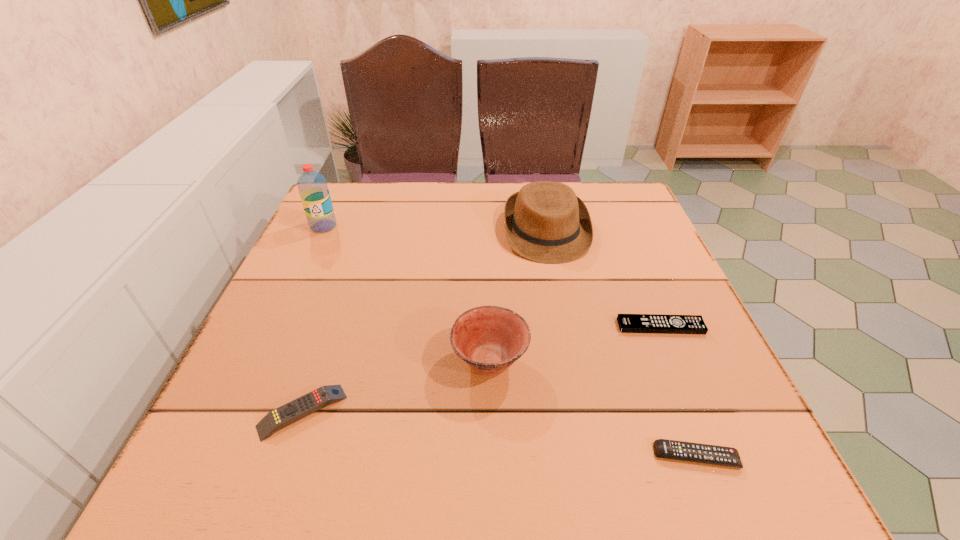
This screenshot has width=960, height=540. In order to click on vacant region located on the back of the bowl in this screenshot , I will do `click(488, 270)`.

This screenshot has height=540, width=960. What are the coordinates of `blank space located on the right of the second object from left to right` in the screenshot? It's located at (457, 411).

The image size is (960, 540). Find the location of `vacant space located 0.250m on the back of the farthest remote control`. vacant space located 0.250m on the back of the farthest remote control is located at coordinates (627, 245).

In order to click on free space located 0.360m on the left of the nearest remote control in this screenshot , I will do `click(421, 456)`.

Find the location of a particular element. The height and width of the screenshot is (540, 960). water bottle that is at the far edge is located at coordinates (312, 186).

You are a GUI agent. You are given a task and a screenshot of the screen. Output one action in this format:
    pyautogui.click(x=<x>, y=<y>)
    Task: Click on the fedora situated at the far edge
    This screenshot has width=960, height=540.
    Given the screenshot: What is the action you would take?
    pyautogui.click(x=545, y=222)

Identify the location of water bottle at the left edge. The image size is (960, 540). (312, 186).

Image resolution: width=960 pixels, height=540 pixels. In order to click on remote control present at the left edge in this screenshot , I will do `click(307, 404)`.

Find the location of a particular element. This screenshot has width=960, height=540. object positioned at the far left corner is located at coordinates (312, 186).

Find the location of `object that is at the near left corner`. object that is at the near left corner is located at coordinates pyautogui.click(x=307, y=404).